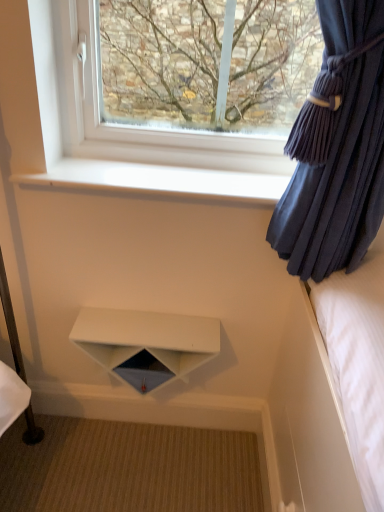
Identify the location of free space underneath white matte shelf at center (from a real-world perspective). The height and width of the screenshot is (512, 384). (153, 434).